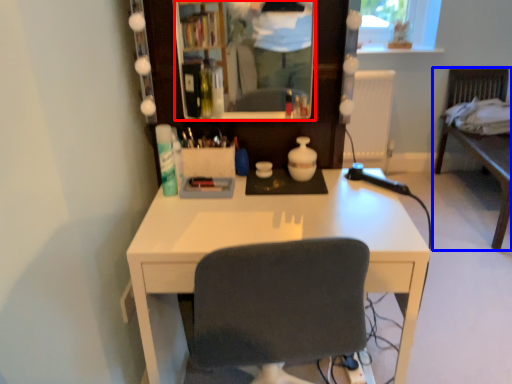
Question: Which point is closer to the camera, mirror (highlighted by a red box) or furniture (highlighted by a blue box)?

Choices:
 (A) mirror
 (B) furniture

Answer: (A)